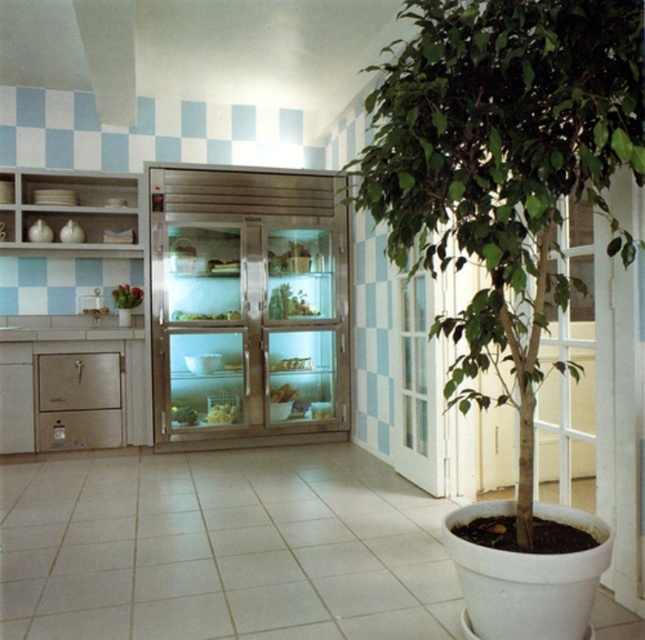
Question: Does green leafy plant at center appear under green leafy vegetables at center?

Choices:
 (A) yes
 (B) no

Answer: (B)

Question: Does green leafy plant at center appear over green leafy vegetables at center?

Choices:
 (A) no
 (B) yes

Answer: (B)

Question: Does green leafy plant at center appear on the left side of green leafy vegetables at center?

Choices:
 (A) no
 (B) yes

Answer: (A)

Question: Which of the following is the farthest from the observer?

Choices:
 (A) green leafy plant at center
 (B) green leafy vegetables at center

Answer: (B)